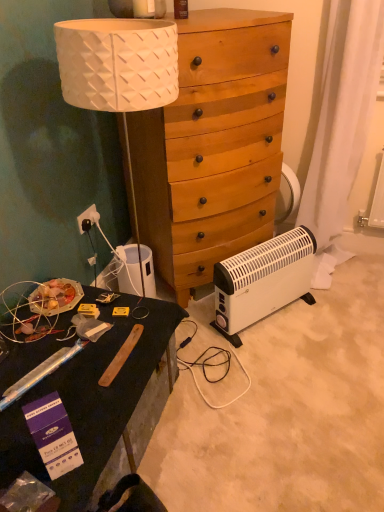
The image size is (384, 512). Find the location of `free space on the front side of purple cardboard box at lower left`. free space on the front side of purple cardboard box at lower left is located at coordinates (48, 492).